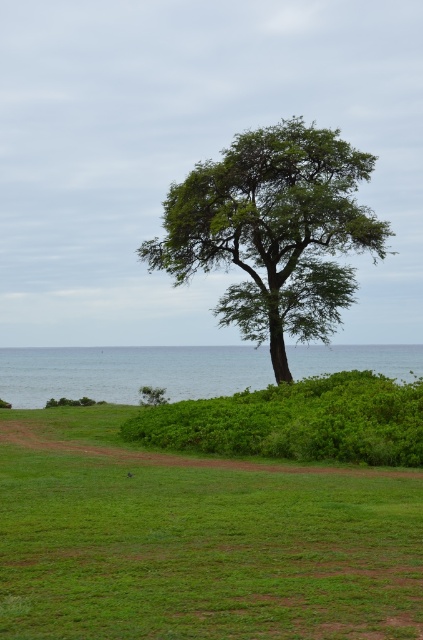
You are a hiker trying to decide where to set up your tent. You have a tent that requires a space larger than the green leafy tree at center. Can you set up your tent on the green grassy field at center based on their sizes?

The green grassy field at center is smaller than the green leafy tree at center. Since the tent requires a space larger than the green leafy tree at center, the green grassy field at center is not large enough to accommodate the tent.